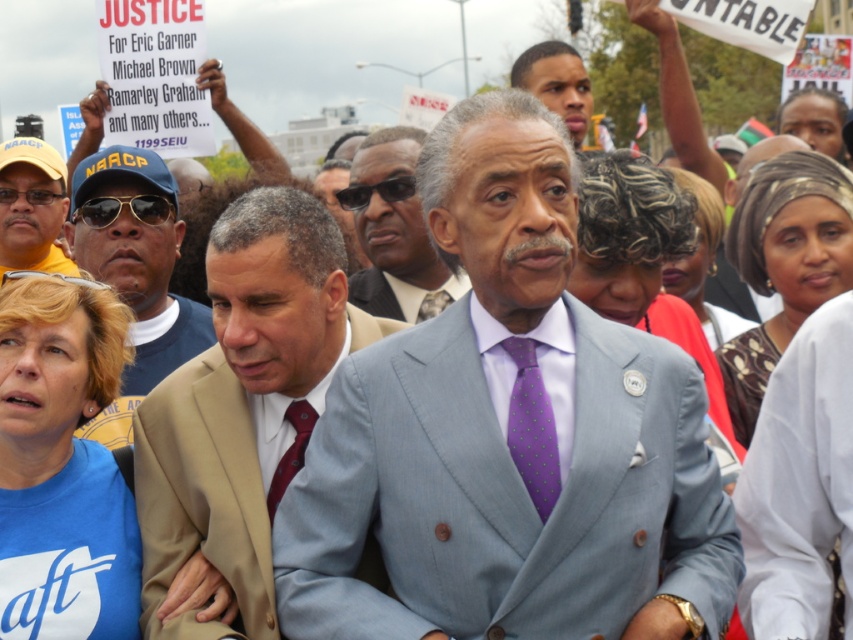
Between light blue suit at center and light gray suit at center, which one is positioned higher?

light gray suit at center

What do you see at coordinates (505, 436) in the screenshot? I see `light blue suit at center` at bounding box center [505, 436].

Find the location of a particular element. The image size is (853, 640). light blue suit at center is located at coordinates (505, 436).

Is purple dotted tie at center to the left of matte black face at upper center from the viewer's perspective?

Yes, purple dotted tie at center is to the left of matte black face at upper center.

Between purple dotted tie at center and matte black face at upper center, which one appears on the right side from the viewer's perspective?

Positioned to the right is matte black face at upper center.

At what (x,y) coordinates should I click in order to perform the action: click on purple dotted tie at center. Please return your answer as a coordinate pair (x, y). The width and height of the screenshot is (853, 640). Looking at the image, I should click on (532, 428).

Who is taller, light blue suit at center or tan suit at center?

light blue suit at center is taller.

Does light blue suit at center appear under tan suit at center?

No.

The width and height of the screenshot is (853, 640). What are the coordinates of `light blue suit at center` in the screenshot? It's located at (505, 436).